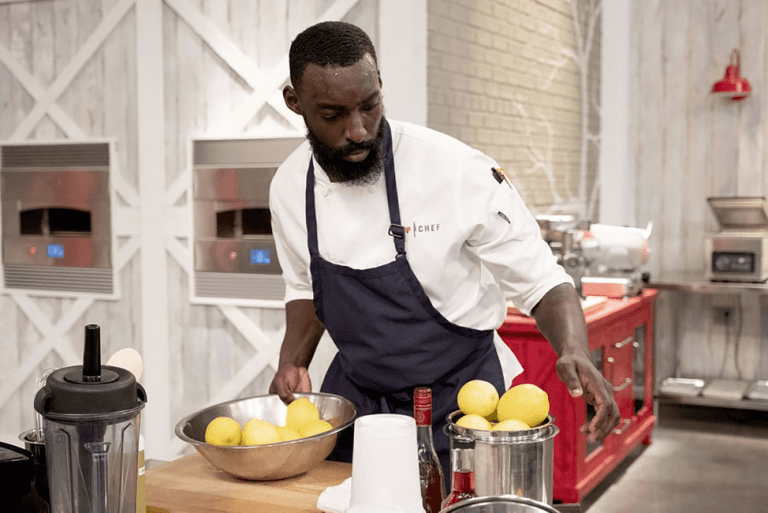
This screenshot has height=513, width=768. I want to click on blender, so click(98, 467).